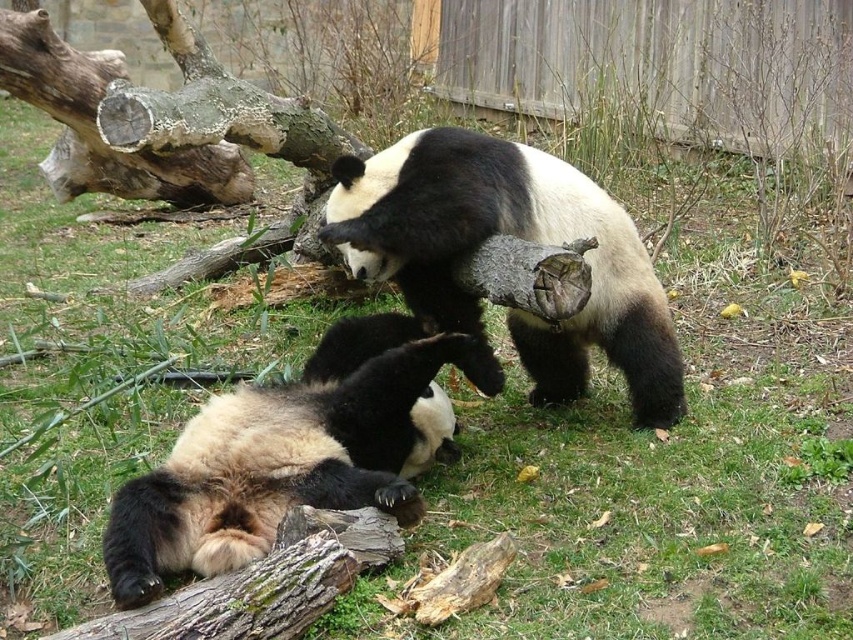
You are a zookeeper trying to determine the best spot to place a new feeding station in the panda enclosure. The enclosure has two specific points marked for consideration. The first point is at coordinates point [410,252], and the second is at point [51,93]. Based on their positions relative to the camera, which point is more suitable for placing the feeding station if you want it to be closer to the pandas?

Point [410,252] is closer to the camera than point [51,93], so it is more suitable for placing the feeding station as it is nearer to the pandas.